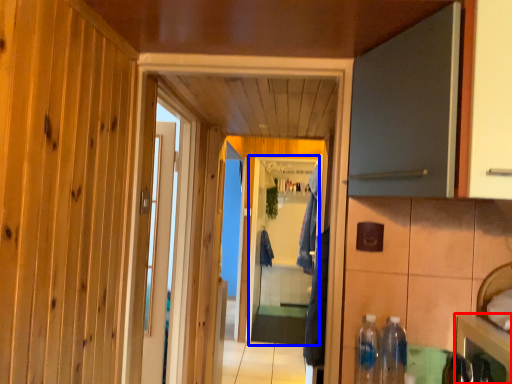
Question: Among these objects, which one is farthest to the camera, cabinetry (highlighted by a red box) or screen door (highlighted by a blue box)?

Choices:
 (A) cabinetry
 (B) screen door

Answer: (B)